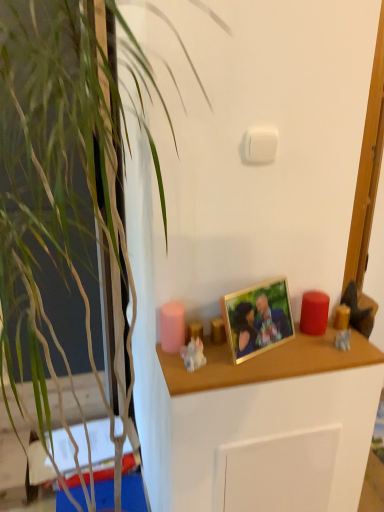
This screenshot has width=384, height=512. Find the location of `empty space that is in between porcelain figurine at center, positioned as the first toy in front-to-back order, and translucent amber glass candle at right, which is the third candle from left to right`. empty space that is in between porcelain figurine at center, positioned as the first toy in front-to-back order, and translucent amber glass candle at right, which is the third candle from left to right is located at coordinates (271, 346).